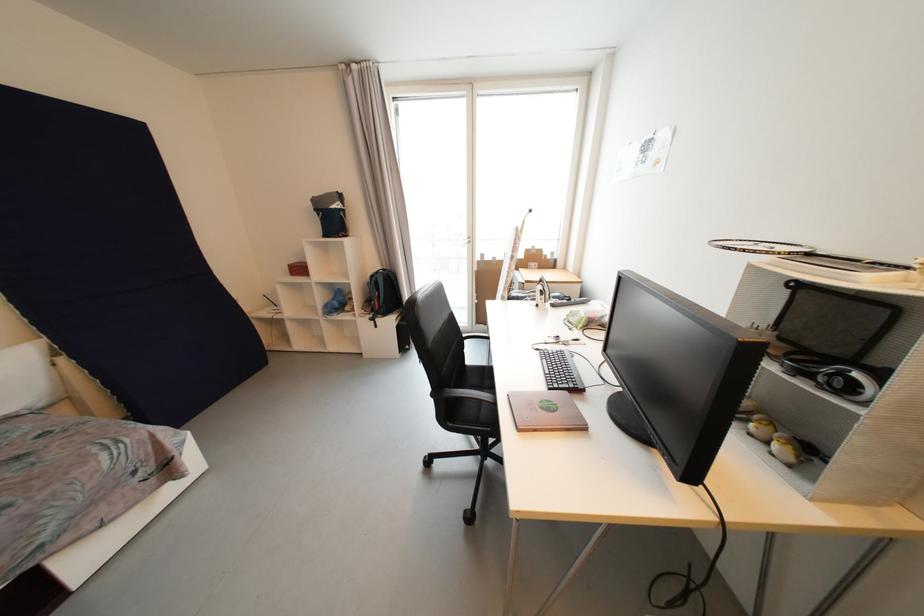
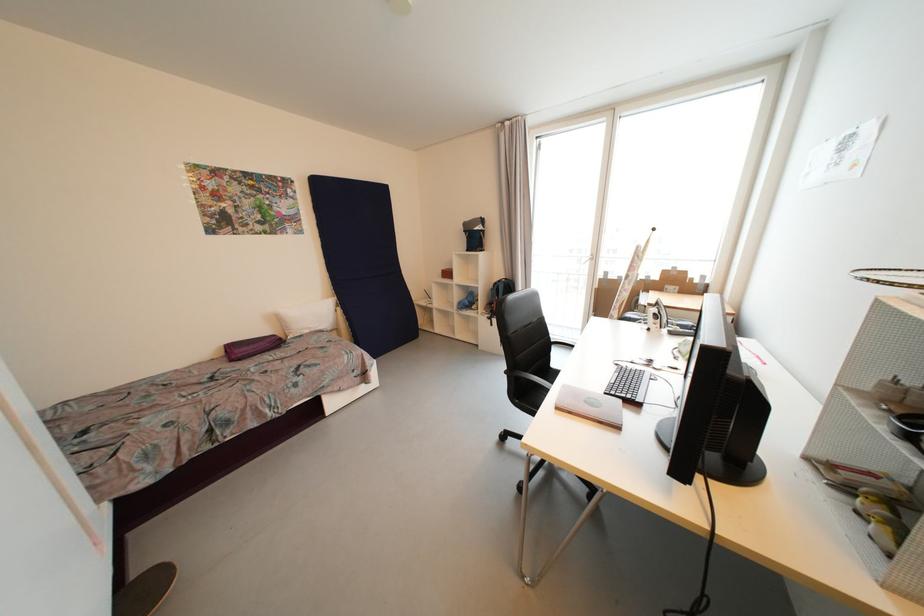
Question: I am providing you with two images of the same scene from different viewpoints. Please identify which objects are invisible in image2.

Choices:
 (A) skateboard deck
 (B) white pillow
 (C) small red box
 (D) none of these

Answer: (D)